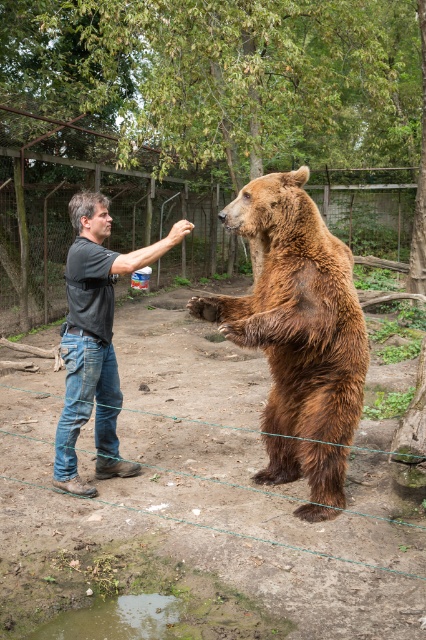
Question: Which point appears farthest from the camera in this image?

Choices:
 (A) (109, 264)
 (B) (405, 234)
 (C) (279, 204)

Answer: (B)

Question: Can you confirm if metal wire fence at center is wider than jeans at center?

Choices:
 (A) no
 (B) yes

Answer: (B)

Question: Is brown furry bear at center thinner than metal wire fence at center?

Choices:
 (A) yes
 (B) no

Answer: (A)

Question: Can you confirm if brown furry bear at center is positioned to the left of jeans at center?

Choices:
 (A) yes
 (B) no

Answer: (B)

Question: Which object appears closest to the camera in this image?

Choices:
 (A) jeans at center
 (B) metal wire fence at center

Answer: (A)

Question: Which object is farther from the camera taking this photo?

Choices:
 (A) brown furry bear at center
 (B) metal wire fence at center
 (C) jeans at center

Answer: (B)